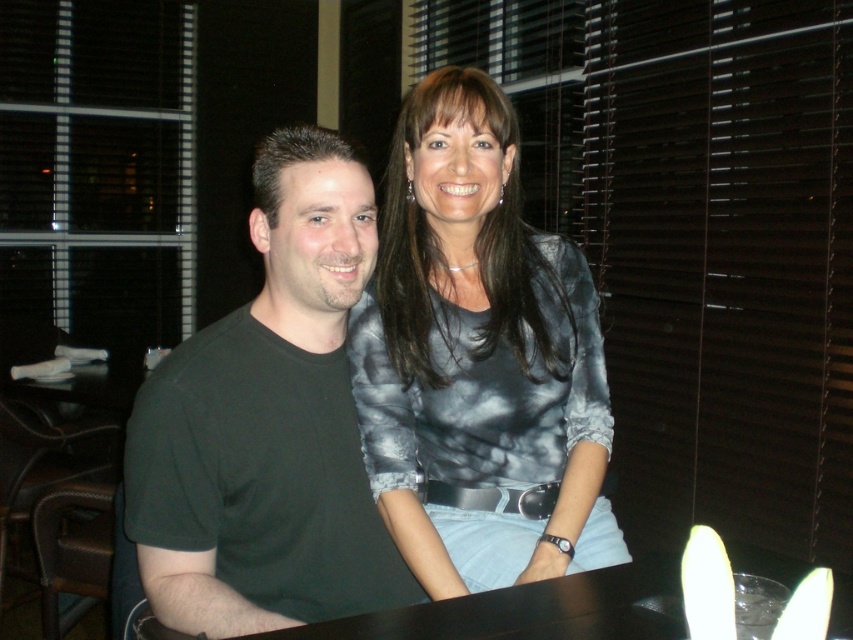
Does matte gray blouse at center appear on the right side of black matte t-shirt at center?

Yes, matte gray blouse at center is to the right of black matte t-shirt at center.

Between matte gray blouse at center and black matte t-shirt at center, which one is positioned lower?

black matte t-shirt at center is lower down.

Find the location of a particular element. The width and height of the screenshot is (853, 640). matte gray blouse at center is located at coordinates (479, 358).

Who is taller, metallic gray shirt at upper center or matte gray blouse at center?

Standing taller between the two is metallic gray shirt at upper center.

Who is higher up, metallic gray shirt at upper center or matte gray blouse at center?

metallic gray shirt at upper center

Describe the element at coordinates (695, 240) in the screenshot. I see `metallic gray shirt at upper center` at that location.

Identify the location of metallic gray shirt at upper center. The height and width of the screenshot is (640, 853). (695, 240).

Between metallic gray shirt at upper center and black matte t-shirt at center, which one is positioned lower?

black matte t-shirt at center

Who is positioned more to the left, metallic gray shirt at upper center or black matte t-shirt at center?

From the viewer's perspective, black matte t-shirt at center appears more on the left side.

Find the location of `metallic gray shirt at upper center`. metallic gray shirt at upper center is located at coordinates (695, 240).